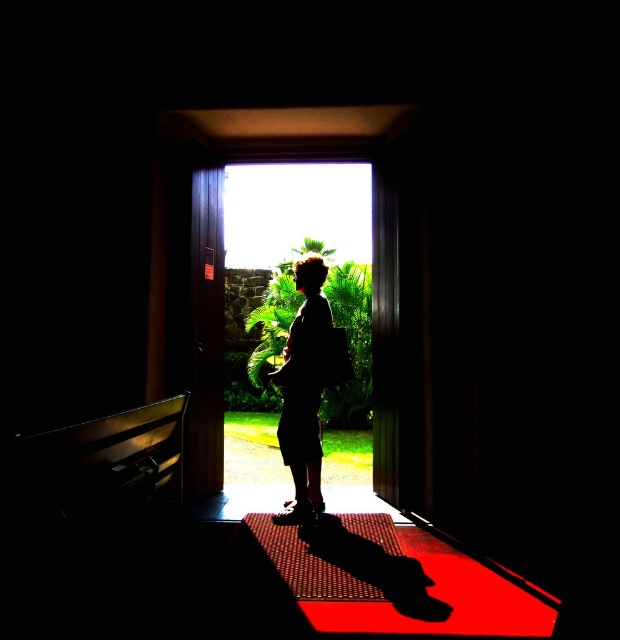
Question: Observing the image, what is the correct spatial positioning of transparent glass door at center in reference to silhouette fabric at center?

Choices:
 (A) right
 (B) left

Answer: (B)

Question: Which object is the closest to the transparent glass door at center?

Choices:
 (A) rubber textured mat at center
 (B) silhouette fabric at center

Answer: (B)

Question: Does wooden door at center have a lesser width compared to rubber textured mat at center?

Choices:
 (A) yes
 (B) no

Answer: (A)

Question: Among these points, which one is farthest from the camera?

Choices:
 (A) (206, 362)
 (B) (303, 435)
 (C) (244, 467)

Answer: (C)

Question: Which object is closer to the camera taking this photo?

Choices:
 (A) rubber textured mat at center
 (B) wooden door at center
 (C) silhouette fabric at center

Answer: (A)

Question: Is transparent glass door at center bigger than silhouette fabric at center?

Choices:
 (A) yes
 (B) no

Answer: (B)